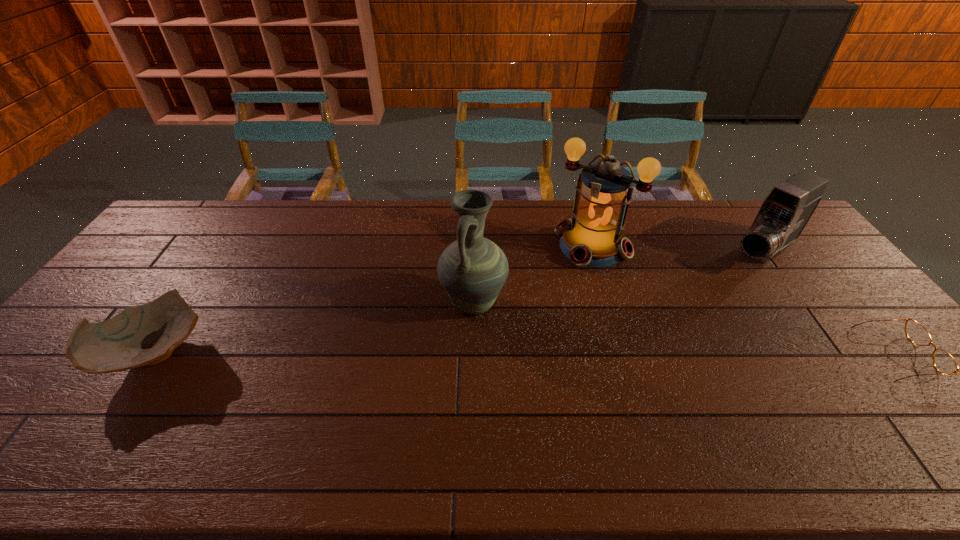
Choose which object is the fourth nearest neighbor to the spectacles. Please provide its 2D coordinates. Your answer should be formatted as a tuple, i.e. [(x, y)], where the tuple contains the x and y coordinates of a point satisfying the conditions above.

[(144, 335)]

Image resolution: width=960 pixels, height=540 pixels. Find the location of `vacant space that satisfies the following two spatial constraints: 1. on the front side of the lantern; 2. on the front-facing side of the spectacles`. vacant space that satisfies the following two spatial constraints: 1. on the front side of the lantern; 2. on the front-facing side of the spectacles is located at coordinates click(x=624, y=355).

Locate an element on the screen. vacant region that satisfies the following two spatial constraints: 1. on the back side of the pitcher; 2. on the right side of the third object from right to left is located at coordinates (474, 246).

Locate an element on the screen. vacant space that satisfies the following two spatial constraints: 1. on the back side of the third shortest object; 2. on the left side of the second shortest object is located at coordinates (222, 253).

The height and width of the screenshot is (540, 960). In order to click on vacant space that satisfies the following two spatial constraints: 1. on the front side of the shortest object; 2. on the front-facing side of the second shortest object in this screenshot , I will do `click(155, 355)`.